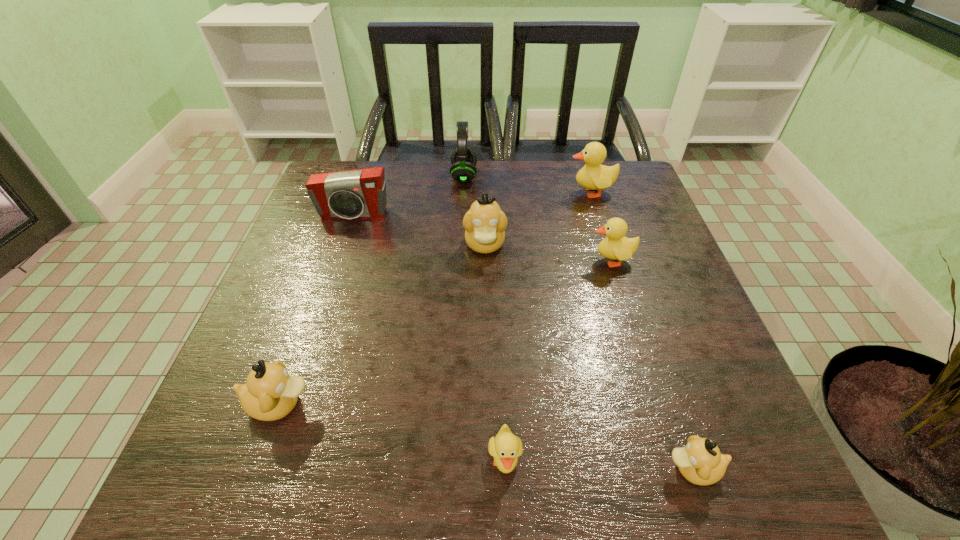
At what (x,y) coordinates should I click in order to perform the action: click on the nearest yellow duckling. Please return your answer as a coordinate pair (x, y). Looking at the image, I should click on (506, 447).

You are a GUI agent. You are given a task and a screenshot of the screen. Output one action in this format:
    pyautogui.click(x=<x>, y=<y>)
    Task: Click on the nearest tan duckling
    This screenshot has height=540, width=960.
    Given the screenshot: What is the action you would take?
    pyautogui.click(x=700, y=462)

Locate an element on the screen. The image size is (960, 540). the rightmost tan duckling is located at coordinates (700, 462).

Image resolution: width=960 pixels, height=540 pixels. In order to click on vacant space located 0.070m on the ear cups of the black headset in this screenshot , I will do `click(501, 177)`.

I want to click on vacant region located 0.160m on the front-facing side of the farthest duckling, so click(x=510, y=192).

This screenshot has height=540, width=960. Identify the location of free spot located on the front-facing side of the farthest duckling. (446, 192).

Locate an element on the screen. This screenshot has height=540, width=960. vacant region located 0.220m on the front-facing side of the farthest duckling is located at coordinates (489, 192).

In order to click on free spot located on the face of the biggest tan duckling in this screenshot , I will do `click(487, 381)`.

You are a GUI agent. You are given a task and a screenshot of the screen. Output one action in this format:
    pyautogui.click(x=<x>, y=<y>)
    Task: Click on the blank space located on the front-facing side of the camera
    The width and height of the screenshot is (960, 540).
    Given the screenshot: What is the action you would take?
    pyautogui.click(x=342, y=249)

At what (x,y) coordinates should I click in order to perform the action: click on vacant space located 0.250m on the front-facing side of the second smallest yellow duckling. Please return your answer as a coordinate pair (x, y). The image size is (960, 540). Looking at the image, I should click on (483, 260).